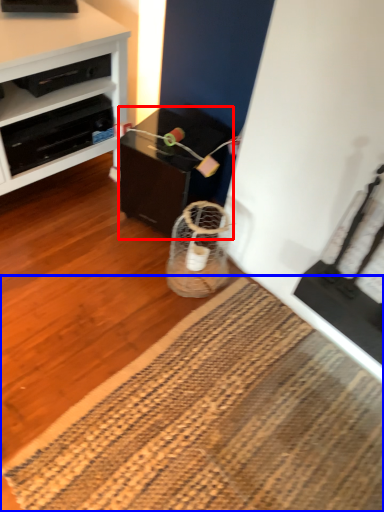
Question: Which object is further to the camera taking this photo, table (highlighted by a red box) or mat (highlighted by a blue box)?

Choices:
 (A) table
 (B) mat

Answer: (A)